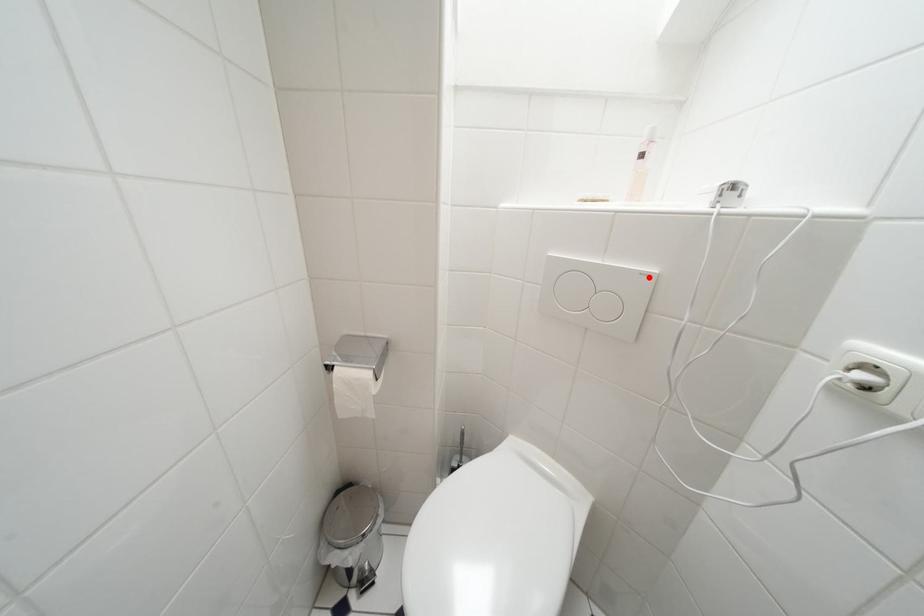
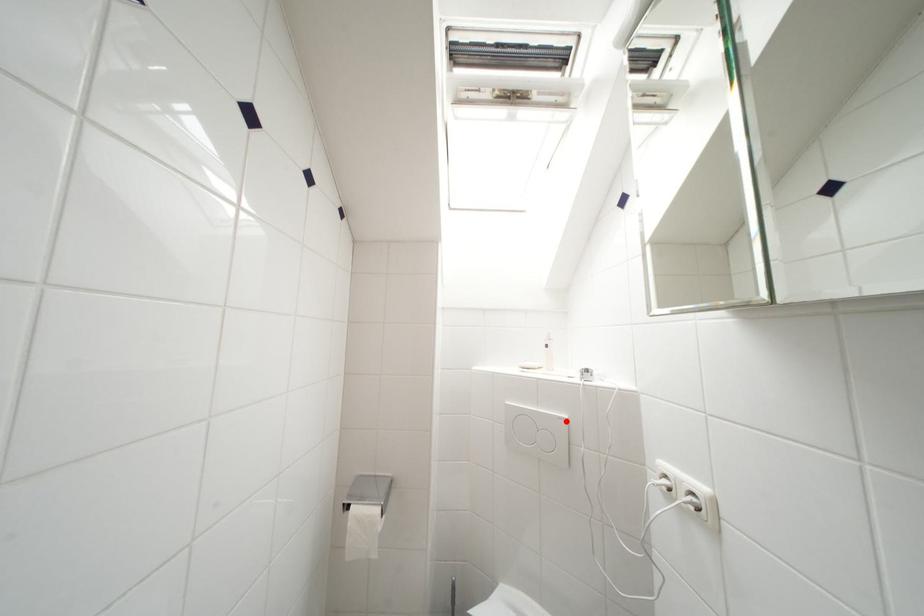
I am providing you with two images of the same scene from different viewpoints. A red point is marked on the first image and another point is marked on the second image. Does the point marked in image1 correspond to the same location as the one in image2?

Yes